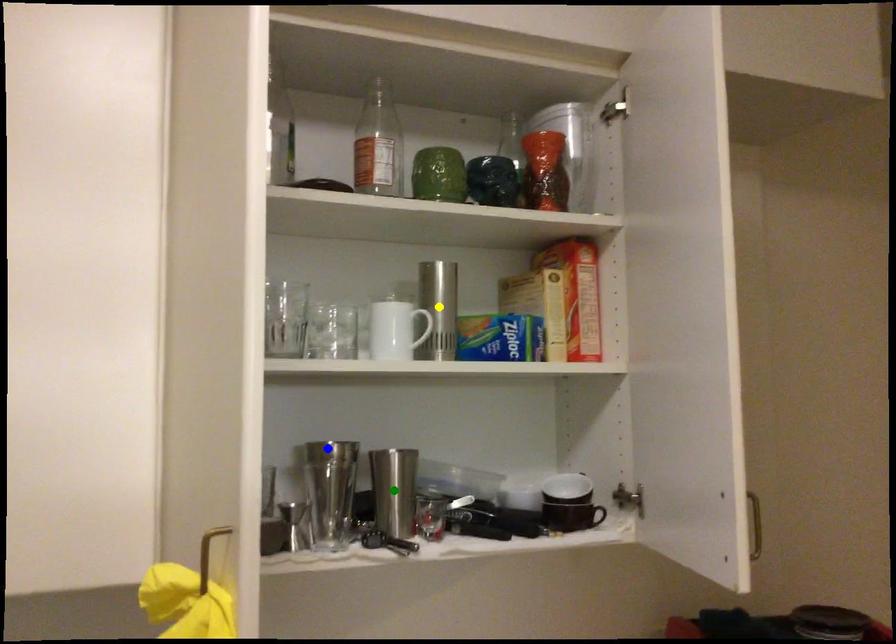
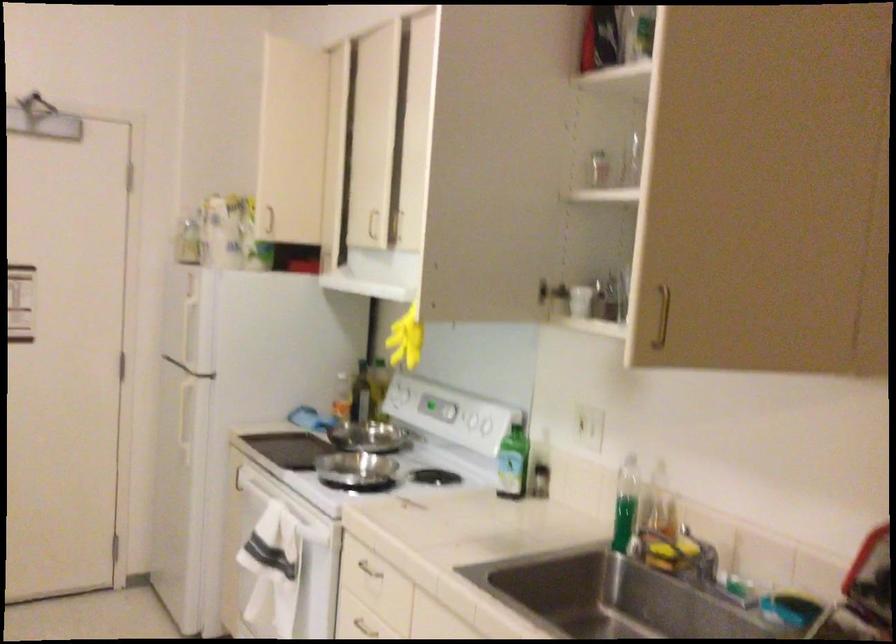
I am providing you with two images of the same scene from different viewpoints. Three points are marked in image1. Which point corresponds to a part or object that is occluded in image2?In image1, three points are marked. Which of them correspond to a part or object that is occluded in image2?Among the three points shown in image1, which one corresponds to a part or object that is no longer visible due to occlusion in image2?

yellow point, green point, blue point